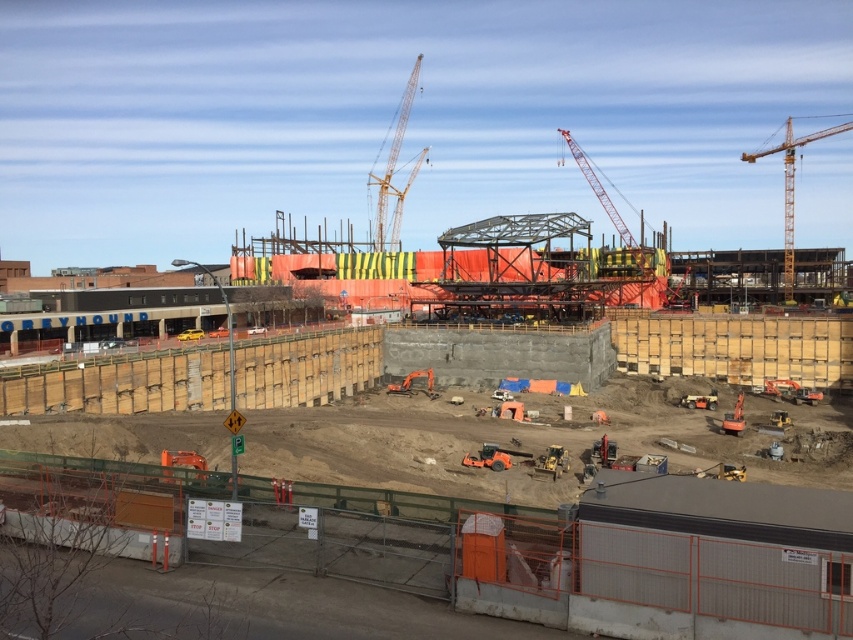
Does concrete wall at center have a greater width compared to yellow metallic crane at upper center?

Yes.

Who is positioned more to the right, concrete wall at center or yellow metallic crane at upper center?

concrete wall at center is more to the right.

Who is more forward, (x=724, y=481) or (x=392, y=173)?

Positioned in front is point (x=724, y=481).

The image size is (853, 640). I want to click on concrete wall at center, so click(x=645, y=582).

Who is positioned more to the right, yellow metallic crane at upper right or yellow metallic crane at upper center?

Result: Positioned to the right is yellow metallic crane at upper right.

Measure the distance between yellow metallic crane at upper right and camera.

yellow metallic crane at upper right and camera are 124.91 meters apart.

Where is `yellow metallic crane at upper right`? This screenshot has width=853, height=640. yellow metallic crane at upper right is located at coordinates (791, 189).

Which is above, concrete wall at center or yellow metallic crane at upper right?

Positioned higher is yellow metallic crane at upper right.

Is point (569, 620) positioned after point (827, 131)?

That is False.

Does point (548, 608) come behind point (787, 209)?

No, it is in front of (787, 209).

Where is `concrete wall at center`? Image resolution: width=853 pixels, height=640 pixels. concrete wall at center is located at coordinates (645, 582).